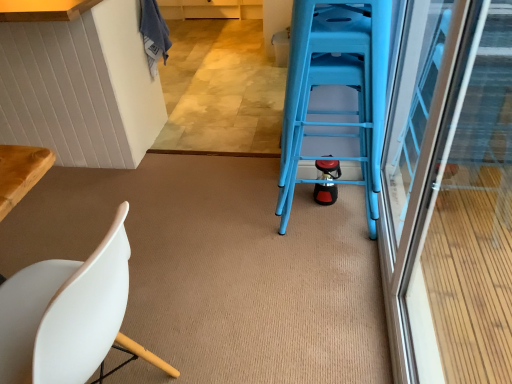
Question: Is transparent glass screen door at right at the back of blue plastic ladder at center?

Choices:
 (A) no
 (B) yes

Answer: (A)

Question: Can you confirm if blue plastic ladder at center is smaller than transparent glass screen door at right?

Choices:
 (A) no
 (B) yes

Answer: (B)

Question: From a real-world perspective, is blue plastic ladder at center on transparent glass screen door at right?

Choices:
 (A) no
 (B) yes

Answer: (A)

Question: Considering the relative positions of blue plastic ladder at center and transparent glass screen door at right in the image provided, is blue plastic ladder at center to the right of transparent glass screen door at right from the viewer's perspective?

Choices:
 (A) no
 (B) yes

Answer: (A)

Question: Is blue plastic ladder at center directly adjacent to transparent glass screen door at right?

Choices:
 (A) no
 (B) yes

Answer: (A)

Question: From a real-world perspective, is blue plastic ladder at center positioned above or below white matte chair at lower left?

Choices:
 (A) above
 (B) below

Answer: (A)

Question: Is point (375, 147) closer or farther from the camera than point (28, 276)?

Choices:
 (A) closer
 (B) farther

Answer: (B)

Question: Is blue plastic ladder at center inside or outside of white matte chair at lower left?

Choices:
 (A) inside
 (B) outside

Answer: (B)

Question: In the image, is blue plastic ladder at center on the left side or the right side of white matte chair at lower left?

Choices:
 (A) right
 (B) left

Answer: (A)

Question: From the image's perspective, relative to white matte chair at lower left, is transparent glass screen door at right above or below?

Choices:
 (A) above
 (B) below

Answer: (A)

Question: Is transparent glass screen door at right inside or outside of white matte chair at lower left?

Choices:
 (A) outside
 (B) inside

Answer: (A)

Question: Does point (419, 74) appear closer or farther from the camera than point (115, 304)?

Choices:
 (A) closer
 (B) farther

Answer: (B)

Question: From a real-world perspective, relative to white matte chair at lower left, is transparent glass screen door at right vertically above or below?

Choices:
 (A) below
 (B) above

Answer: (B)

Question: From a real-world perspective, is white matte chair at lower left above or below transparent glass screen door at right?

Choices:
 (A) below
 (B) above

Answer: (A)

Question: Does point (72, 264) appear closer or farther from the camera than point (483, 144)?

Choices:
 (A) farther
 (B) closer

Answer: (B)